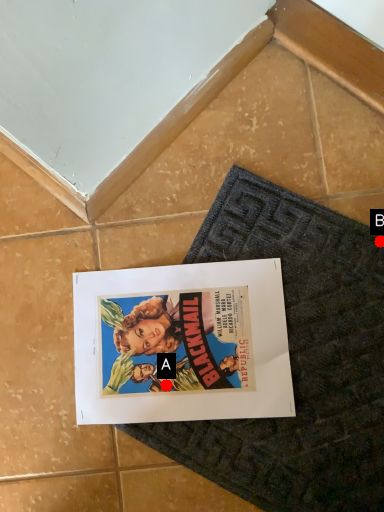
Question: Two points are circled on the image, labeled by A and B beside each circle. Which point is closer to the camera taking this photo?

Choices:
 (A) A is closer
 (B) B is closer

Answer: (B)